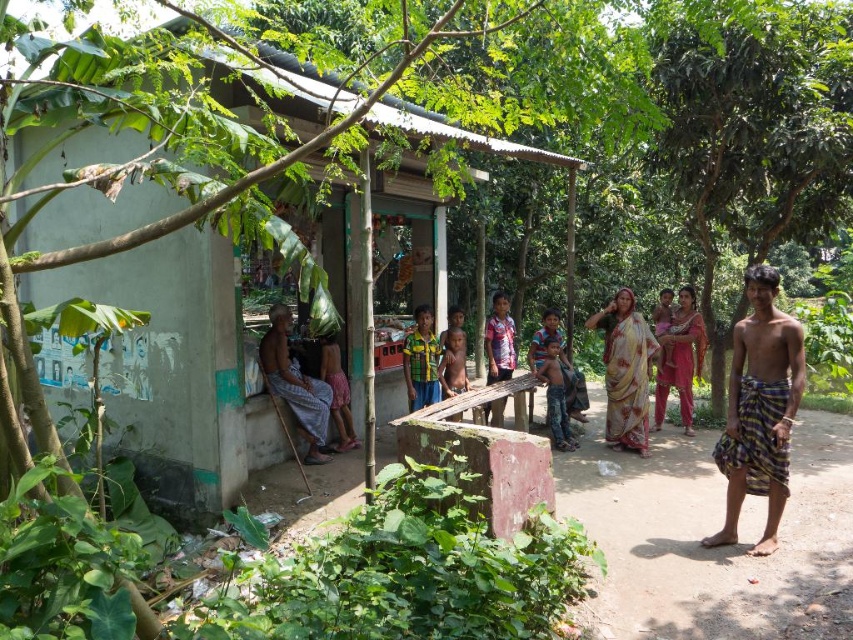
Can you confirm if green leafy tree at right is taller than green corrugated metal hut at center?

Yes.

Is point (776, 74) farther from viewer compared to point (169, 116)?

Yes, it is.

Locate an element on the screen. This screenshot has width=853, height=640. green leafy tree at right is located at coordinates (752, 124).

Looking at this image, is striped cotton sarong at right bigger than light brown fabric at center?

Yes.

Is striped cotton sarong at right further to camera compared to light brown fabric at center?

No, striped cotton sarong at right is closer to the viewer.

The image size is (853, 640). I want to click on striped cotton sarong at right, so click(759, 410).

Find the location of `striped cotton sarong at right`. striped cotton sarong at right is located at coordinates (759, 410).

Between striped cotton sarong at right and checkered fabric shirt at center, which one is positioned higher?

Positioned higher is checkered fabric shirt at center.

Who is shorter, striped cotton sarong at right or checkered fabric shirt at center?

checkered fabric shirt at center is shorter.

Identify the location of striped cotton sarong at right. This screenshot has width=853, height=640. (759, 410).

Identify the location of striped cotton sarong at right. Image resolution: width=853 pixels, height=640 pixels. (759, 410).